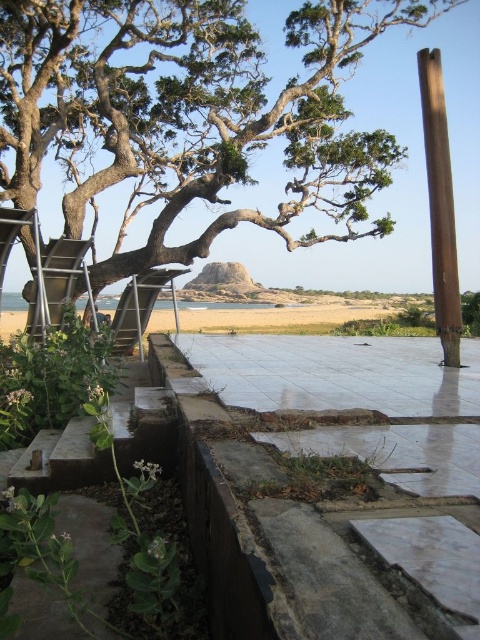
You are standing in the middle of the patio and want to reach both the brown wooden pole at right and the metallic silver ladder at left. Which object will you encounter first as you move forward?

You will encounter the brown wooden pole at right first because it is closer to you than the metallic silver ladder at left.

You are a painter who needs to place a 3ft wide canvas on either the gray concrete at lower center or the brown wooden pole at right. Based on the scene, which surface can accommodate the canvas without it hanging off the edge?

The gray concrete at lower center has a larger width than the brown wooden pole at right, so the gray concrete at lower center can accommodate the 3ft wide canvas without it hanging off the edge.

You are standing at the edge of the patio looking towards the beach. There is a gray concrete at lower center marked by point (324,513). Can you confirm if the wooden pole on the right is closer to you than the gray concrete at lower center?

The gray concrete at lower center is represented by point (324,513). The wooden pole on the right is closer to you than the gray concrete at lower center.